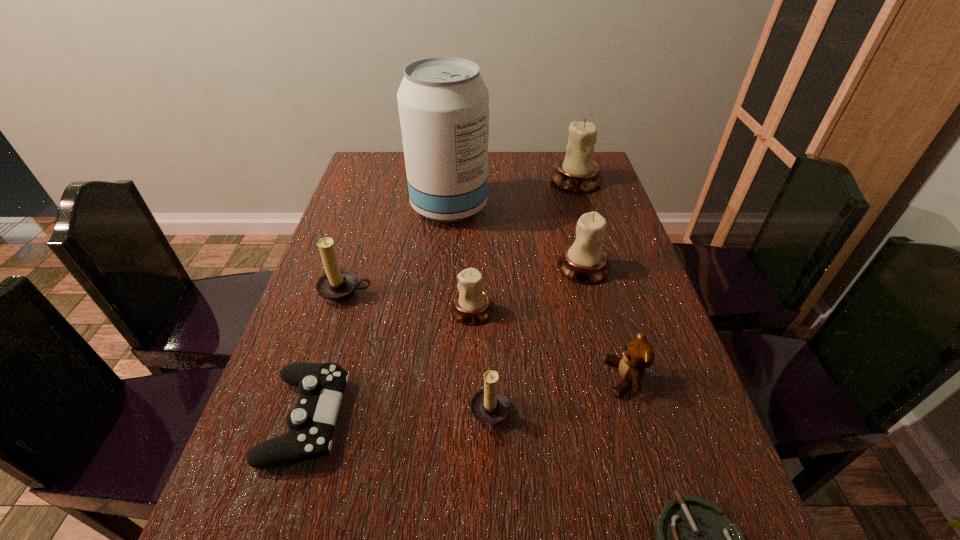
This screenshot has width=960, height=540. I want to click on object positioned at the far right corner, so click(577, 172).

Locate an element on the screen. The height and width of the screenshot is (540, 960). blank space at the far edge of the desktop is located at coordinates (502, 180).

Locate an element on the screen. vacant space at the left edge is located at coordinates (295, 528).

The height and width of the screenshot is (540, 960). I want to click on vacant region at the right edge of the desktop, so [x=698, y=442].

Where is `free area in between the farther brown candle holder and the brown teddy bear`? The image size is (960, 540). free area in between the farther brown candle holder and the brown teddy bear is located at coordinates (485, 335).

I want to click on vacant region between the teddy bear and the nearer brown candle holder, so click(558, 398).

You are a GUI agent. You are given a task and a screenshot of the screen. Output one action in this format:
    pyautogui.click(x=<x>, y=<y>)
    Task: Click on the free space between the biggest white candle holder and the leftmost white candle holder
    
    Given the screenshot: What is the action you would take?
    pyautogui.click(x=524, y=245)

Find the location of a particular element. The width and height of the screenshot is (960, 540). free space between the tallest candle holder and the left brown candle holder is located at coordinates (461, 237).

You are a GUI agent. You are given a task and a screenshot of the screen. Output one action in this format:
    pyautogui.click(x=<x>, y=<y>)
    Task: Click on the free space between the second smallest white candle holder and the right brown candle holder
    
    Given the screenshot: What is the action you would take?
    pyautogui.click(x=537, y=342)

Locate an element on the screen. This screenshot has width=960, height=540. free spot between the black control and the leftmost white candle holder is located at coordinates (390, 364).